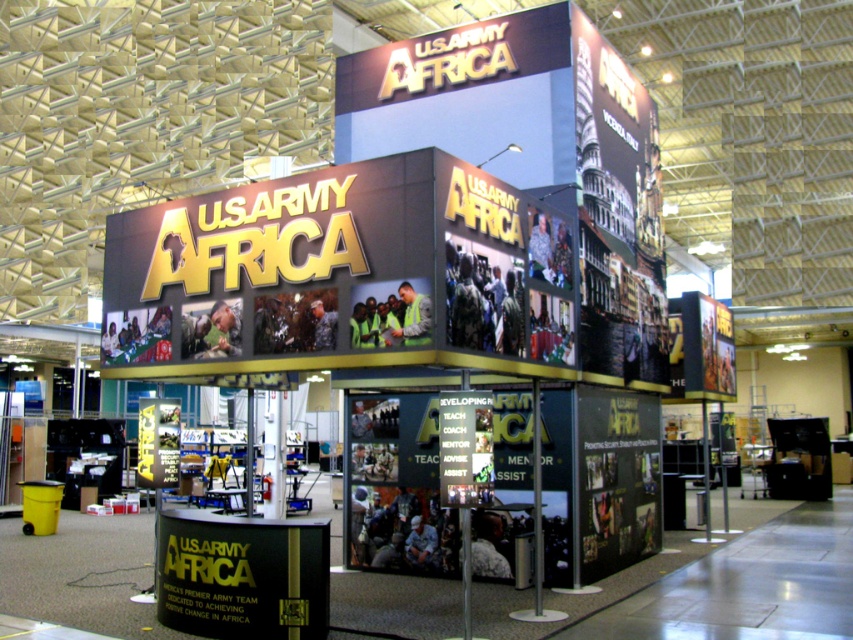
You are at the U.S. Army Africa booth and want to locate the Vicenza information. The booth has a matte gold sign at center and a black matte sign at center. Which sign is positioned to the right of the other?

The matte gold sign at center is to the right of the black matte sign at center.

You are a visitor at the convention and want to take a photo of both the matte gold sign at center and the black matte sign at center. If your camera can capture a maximum distance of 8 feet between objects in focus, will both signs be in focus in the same photo?

The distance between the matte gold sign at center and the black matte sign at center is 7.90 feet, which is under the camera maximum of 8 feet. Therefore, both signs will be in focus in the same photo.